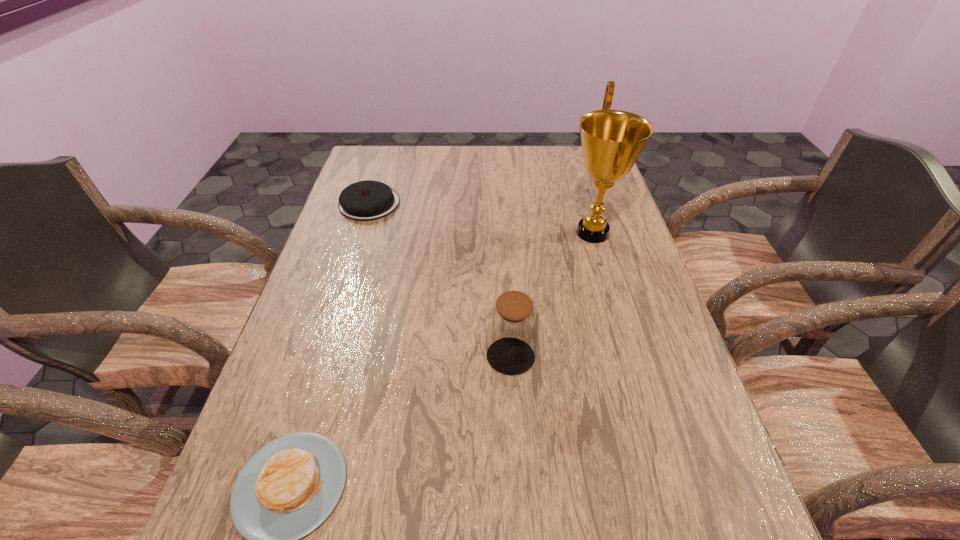
This screenshot has height=540, width=960. Identify the location of vacant region between the second tallest object and the farther pancake. (440, 280).

Where is `vacant space that is in between the farther pancake and the tallest object`? The height and width of the screenshot is (540, 960). vacant space that is in between the farther pancake and the tallest object is located at coordinates (481, 218).

Locate which object is the closest to the tallest object. Please provide its 2D coordinates. Your answer should be formatted as a tuple, i.e. [(x, y)], where the tuple contains the x and y coordinates of a point satisfying the conditions above.

[(512, 330)]

At what (x,y) coordinates should I click in order to perform the action: click on object that can be found as the closest to the nearest object. Please return your answer as a coordinate pair (x, y). The image size is (960, 540). Looking at the image, I should click on (512, 330).